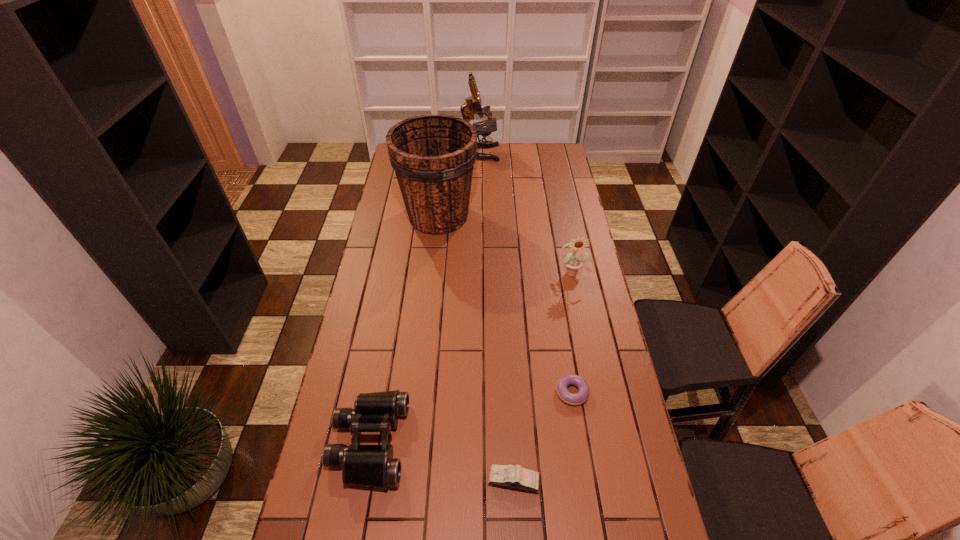
Where is `vacant region between the diary and the fourth nearest object`? This screenshot has height=540, width=960. vacant region between the diary and the fourth nearest object is located at coordinates (543, 376).

The height and width of the screenshot is (540, 960). In order to click on empty location between the fourth tallest object and the diary in this screenshot , I will do `click(442, 461)`.

Find the location of a particular element. The height and width of the screenshot is (540, 960). vacant region between the farthest object and the diary is located at coordinates (496, 316).

Identify the location of vacant area between the doughnut and the third shortest object. The width and height of the screenshot is (960, 540). (470, 417).

The image size is (960, 540). I want to click on free spot between the third tallest object and the diary, so click(x=543, y=376).

Where is `empty space that is in between the diary and the farthest object`? empty space that is in between the diary and the farthest object is located at coordinates (496, 316).

Find the location of a particular element. free space between the sunflower and the doughnut is located at coordinates (572, 332).

Identify the location of unoccupied position between the farthest object and the doughnut. This screenshot has height=540, width=960. (526, 272).

Where is `free space between the second farthest object and the fourth nearest object`? free space between the second farthest object and the fourth nearest object is located at coordinates (506, 244).

Where is `free space that is in between the microscope and the diary`? This screenshot has width=960, height=540. free space that is in between the microscope and the diary is located at coordinates (496, 316).